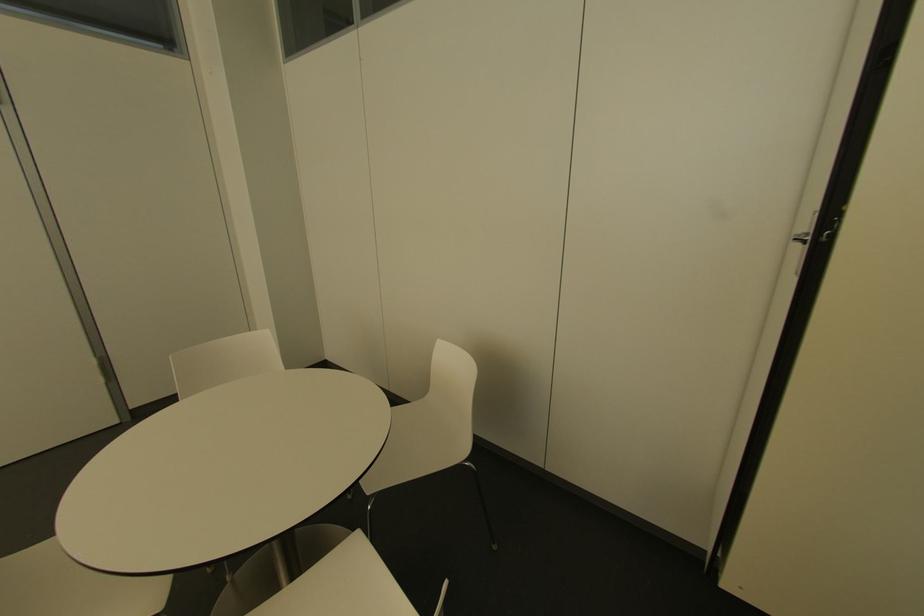
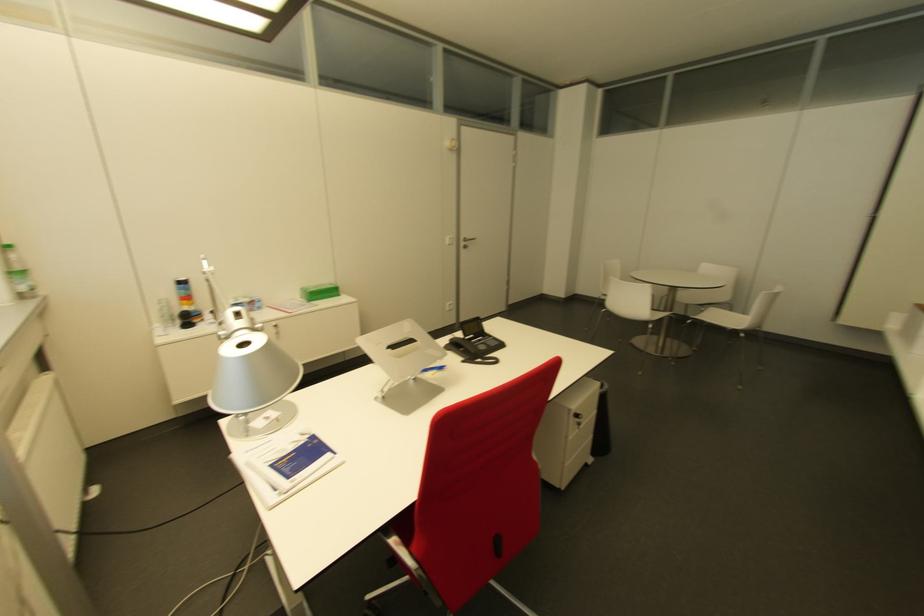
In a continuous first-person perspective shot, in which direction is the camera moving?

The cameraman moved toward left, backward.